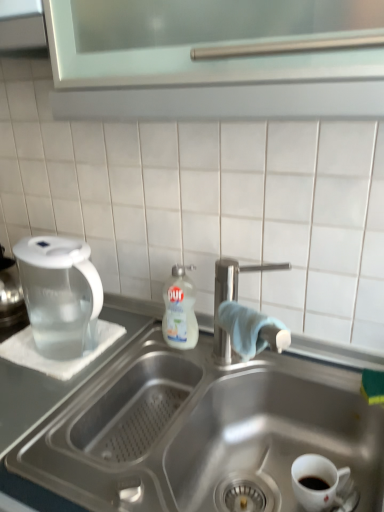
Question: Considering their positions, is satin nickel faucet at sink center located in front of or behind stainless steel sink at center?

Choices:
 (A) behind
 (B) front

Answer: (A)

Question: Based on their sizes in the image, would you say satin nickel faucet at sink center is bigger or smaller than stainless steel sink at center?

Choices:
 (A) big
 (B) small

Answer: (B)

Question: Which of these objects is positioned farthest from the stainless steel sink at center?

Choices:
 (A) satin nickel faucet at sink center
 (B) transparent plastic pitcher at left
 (C) white glossy dish soap at center
 (D) white glossy mug at lower right

Answer: (B)

Question: Considering the real-world distances, which object is closest to the white glossy dish soap at center?

Choices:
 (A) transparent plastic pitcher at left
 (B) satin nickel faucet at sink center
 (C) white glossy mug at lower right
 (D) stainless steel sink at center

Answer: (B)